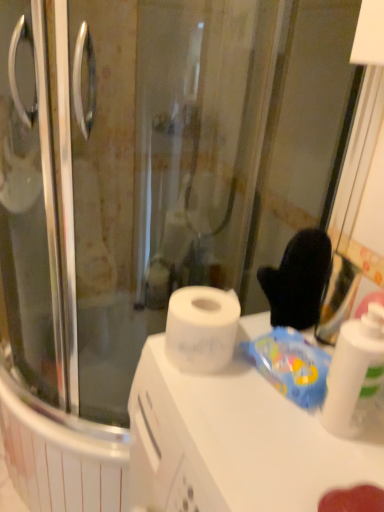
You are a GUI agent. You are given a task and a screenshot of the screen. Output one action in this format:
    pyautogui.click(x=<x>, y=<y>)
    Task: Click on the vacant space situated on the left part of white glossy bottle at right
    This screenshot has height=512, width=384.
    Given the screenshot: What is the action you would take?
    pyautogui.click(x=249, y=428)